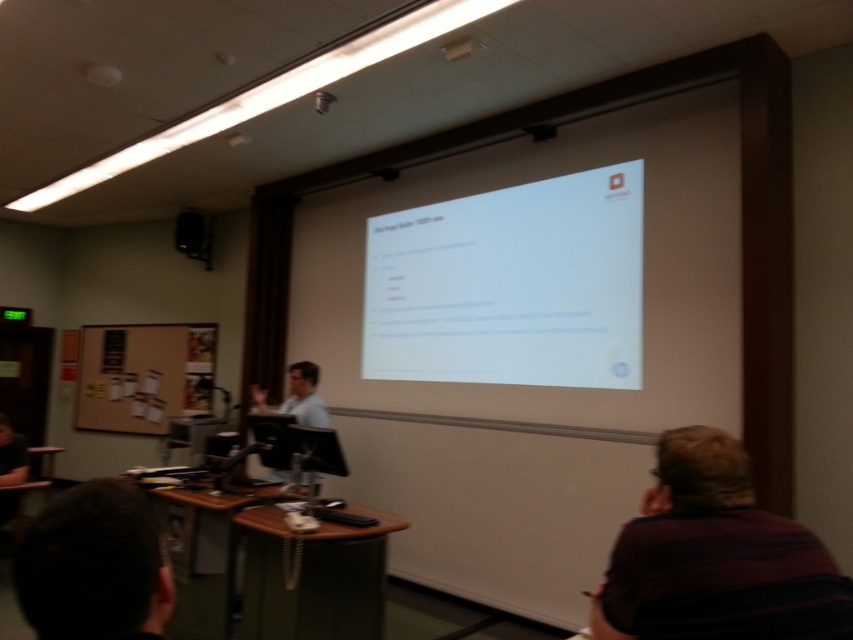
You are a student sitting at the desk in the classroom. You want to show your teacher the striped sweater at lower right but need to ensure it can be seen clearly by everyone in the room. Considering the white matte projector screen at center, which object is bigger and would be better for displaying your sweater to the class?

The white matte projector screen at center is larger than the striped sweater at lower right, so it would be better to use the white matte projector screen at center to display the sweater to the class for better visibility.

You are a student sitting at the desk with the striped sweater at lower right. You need to present a slide that requires the white matte projector screen at center to be at least 1.5 meters wide. Can you confirm if the screen is wide enough?

The white matte projector screen at center might be wider than striped sweater at lower right, so it is possible that the screen meets the required width of 1.5 meters. However, without exact measurements, we cannot be certain.